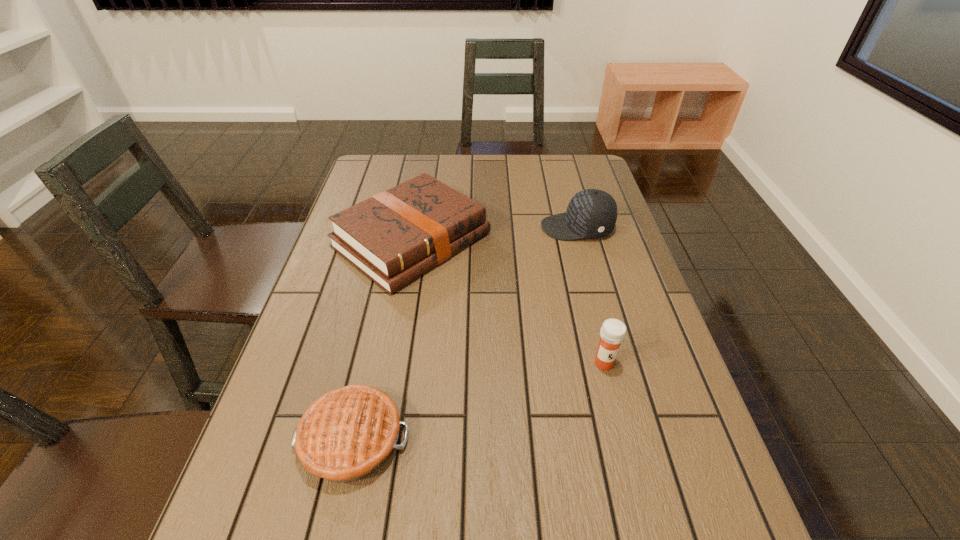
Locate an element on the screen. The height and width of the screenshot is (540, 960). baseball cap is located at coordinates (592, 213).

You are a GUI agent. You are given a task and a screenshot of the screen. Output one action in this format:
    pyautogui.click(x=<x>, y=<y>)
    Task: Click on the second nearest object
    
    Given the screenshot: What is the action you would take?
    pyautogui.click(x=613, y=331)

Identify the location of hardback book. This screenshot has height=540, width=960. (397, 235).

Identify the location of the shortest object. (348, 433).

Locate an element on the screen. The height and width of the screenshot is (540, 960). pie is located at coordinates (348, 433).

At what (x,y) coordinates should I click in order to perform the action: click on free spot located 0.130m at the front of the baseball cap where the brim is located. Please return your answer as a coordinate pair (x, y). Looking at the image, I should click on (497, 227).

Identify the location of vacant space located at the front of the baseball cap where the brim is located. (491, 227).

The width and height of the screenshot is (960, 540). I want to click on vacant space situated 0.050m at the front of the baseball cap where the brim is located, so pyautogui.click(x=524, y=227).

Where is `free space located on the label side of the medicine`? This screenshot has width=960, height=540. free space located on the label side of the medicine is located at coordinates (628, 460).

This screenshot has width=960, height=540. What are the coordinates of `free space located on the back of the hardback book` in the screenshot? It's located at (421, 187).